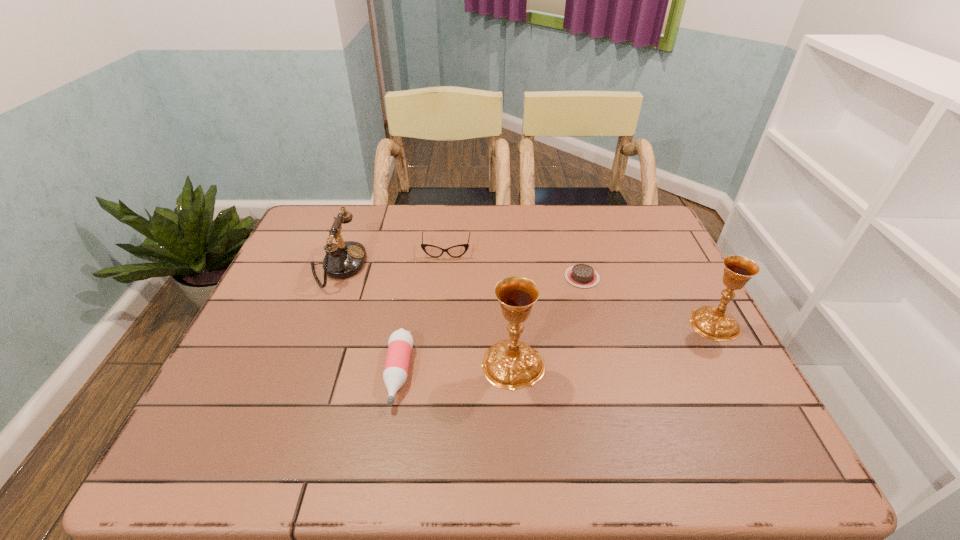
Image resolution: width=960 pixels, height=540 pixels. What are the coordinates of `the taller chalice` in the screenshot? It's located at (509, 364).

Where is `the tallest object`? the tallest object is located at coordinates (509, 364).

You are a GUI agent. You are given a task and a screenshot of the screen. Output one action in this format:
    pyautogui.click(x=<x>, y=<y>)
    Task: Click on the right chalice
    
    Given the screenshot: What is the action you would take?
    pyautogui.click(x=711, y=322)

Locate an element on the screen. Image resolution: width=960 pixels, height=540 pixels. the shorter chalice is located at coordinates (711, 322).

At what (x,y) coordinates should I click in order to perform the action: click on the leftmost object. Please return your answer as a coordinate pair (x, y). Looking at the image, I should click on (342, 260).

Find the location of `telephone`. telephone is located at coordinates (342, 260).

Find the location of a particular element. This screenshot has width=960, height=540. the second object from right to left is located at coordinates (581, 275).

Where is `chocolate cake`? The width and height of the screenshot is (960, 540). chocolate cake is located at coordinates coord(581,275).

Identify the location of spectacles. click(456, 251).

Find the location of `bottle`. bottle is located at coordinates (400, 343).